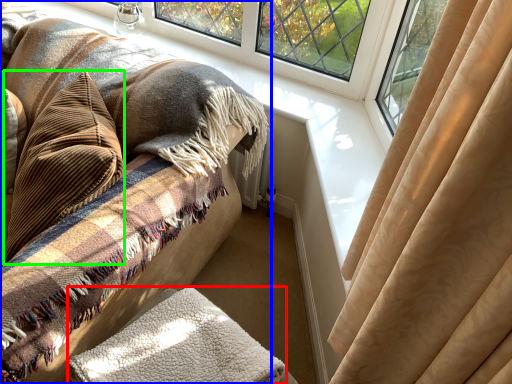
Question: Which is nearer to the blanket (highlighted by a red box)? furniture (highlighted by a blue box) or throw pillow (highlighted by a green box).

Choices:
 (A) furniture
 (B) throw pillow

Answer: (A)